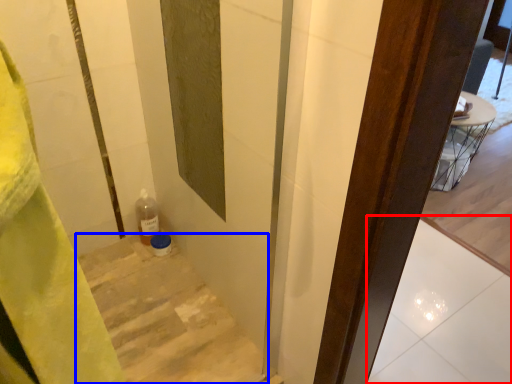
Question: Which point is further to the camera, tile (highlighted by a red box) or stairs (highlighted by a blue box)?

Choices:
 (A) tile
 (B) stairs

Answer: (A)